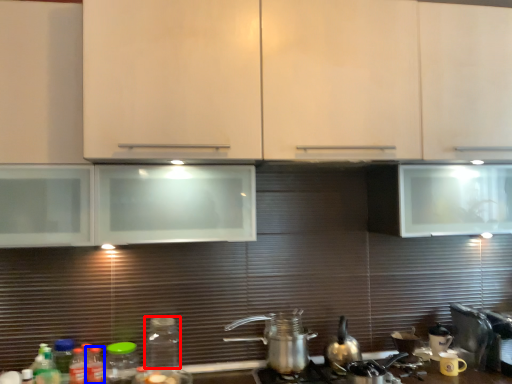
Question: Which point is further to the camera, bottle (highlighted by a red box) or bottle (highlighted by a blue box)?

Choices:
 (A) bottle
 (B) bottle

Answer: (B)